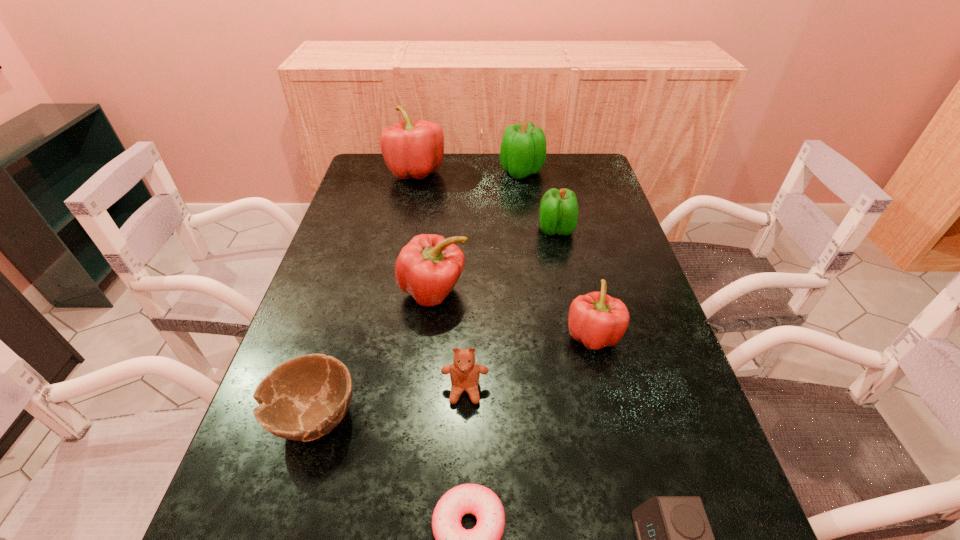
Image resolution: width=960 pixels, height=540 pixels. What are the coordinates of `the farthest pink bell pepper` in the screenshot? It's located at (410, 149).

You are a GUI agent. You are given a task and a screenshot of the screen. Output one action in this format:
    pyautogui.click(x=<x>, y=<y>)
    Task: Click on the bigger green bell pepper
    
    Given the screenshot: What is the action you would take?
    click(x=523, y=148)

This screenshot has height=540, width=960. Find the location of `the second biggest pink bell pepper`. the second biggest pink bell pepper is located at coordinates (428, 267).

In order to click on the third farthest bell pepper in this screenshot , I will do `click(558, 214)`.

This screenshot has height=540, width=960. Identify the location of the smaller green bell pepper. (558, 214).

Where is `the rightmost pink bell pepper`? Image resolution: width=960 pixels, height=540 pixels. the rightmost pink bell pepper is located at coordinates (597, 320).

The height and width of the screenshot is (540, 960). In order to click on teddy bear in this screenshot , I will do `click(464, 373)`.

At what (x,y) coordinates should I click in order to perform the action: click on the third shortest object. Please return your answer as a coordinate pair (x, y). The image size is (960, 540). Looking at the image, I should click on (304, 398).

Identify the location of free spot located on the right of the biggest pink bell pepper. This screenshot has width=960, height=540. (503, 173).

Where is `vacant area situated 0.270m on the front of the bigger green bell pepper`? This screenshot has width=960, height=540. vacant area situated 0.270m on the front of the bigger green bell pepper is located at coordinates (530, 232).